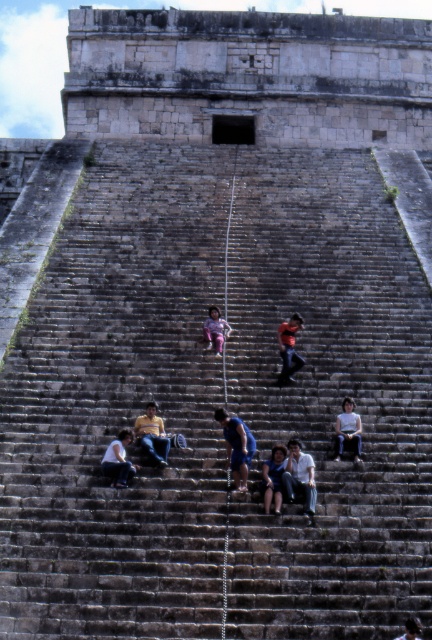
Question: Is blue denim shorts at center wider than white matte shirt at lower center?

Choices:
 (A) no
 (B) yes

Answer: (B)

Question: Among these objects, which one is farthest from the camera?

Choices:
 (A) white matte shirt at lower center
 (B) blue denim jeans at lower center
 (C) blue denim jeans at center

Answer: (A)

Question: Which point is closer to the camera?

Choices:
 (A) (238, 426)
 (B) (212, 330)

Answer: (A)

Question: Can you confirm if light blue jeans at lower left is wider than blue denim jeans at lower center?

Choices:
 (A) no
 (B) yes

Answer: (B)

Question: Which is farther from the white matte shirt at lower center?

Choices:
 (A) pink fabric pants at center
 (B) blue denim jeans at lower center
 (C) yellow sweater at center
 (D) dark blue jeans at center

Answer: (B)

Question: Can you confirm if yellow sweater at center is positioned below white matte shirt at lower center?

Choices:
 (A) no
 (B) yes

Answer: (B)